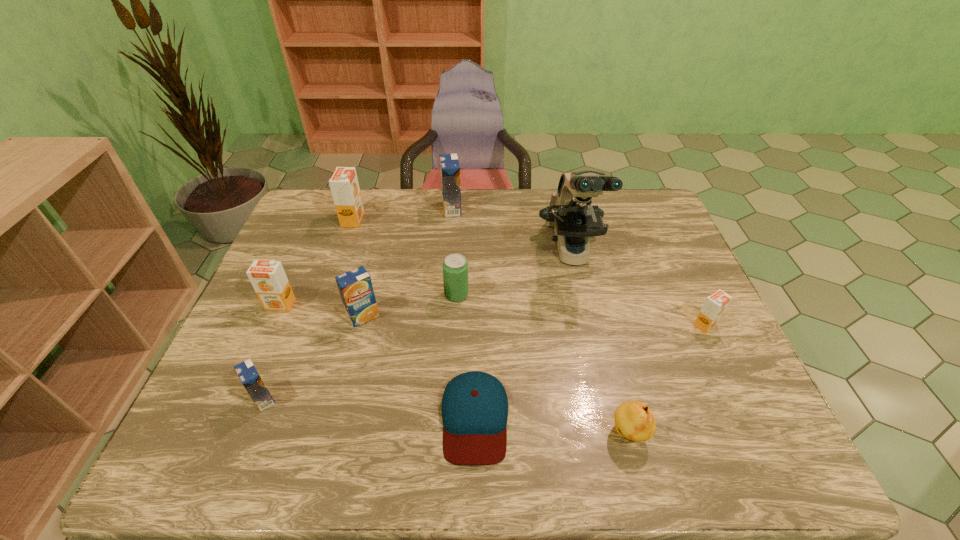
This screenshot has width=960, height=540. I want to click on orange orange juice that is the nearest to the leftmost orange orange juice, so click(x=344, y=185).

I want to click on vacant region that satisfies the following two spatial constraints: 1. on the front side of the pear; 2. on the right side of the second farthest blue orange_juice, so click(334, 433).